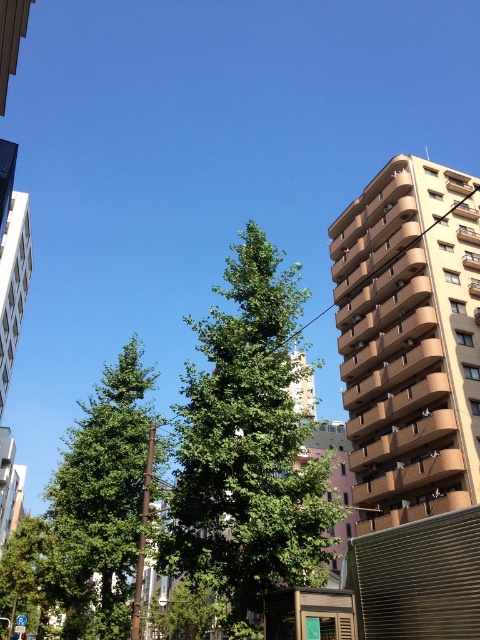
You are a city planner analyzing the urban scene. You notice the green leafy tree at center and the green leafy tree at left. Which tree has a smaller trunk diameter?

The green leafy tree at center has a smaller trunk diameter than the green leafy tree at left.

You are standing at the point with coordinates point (247,449) in the urban scene. What object are you directly facing?

The point (247,449) corresponds to the green leafy tree at center, so you are directly facing the green leafy tree at center.

You are a gardener standing between the green leafy tree at center and the green leafy tree at left. You need to place a 5 meter long hose between them. Will the hose reach from one to the other?

The distance between the green leafy tree at center and the green leafy tree at left is 4.73 meters. Since the hose is 5 meters long, it will be long enough to reach between them.